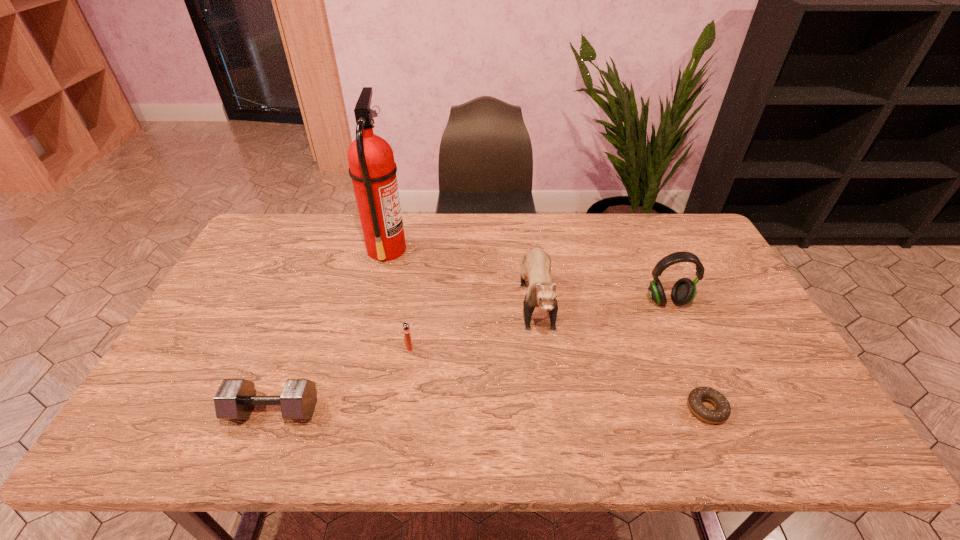
This screenshot has height=540, width=960. What are the coordinates of `vacant space at the far left corner of the desktop` in the screenshot? It's located at (282, 251).

Image resolution: width=960 pixels, height=540 pixels. I want to click on unoccupied area between the igniter and the leftmost object, so click(x=342, y=379).

I want to click on free space between the headset and the shortest object, so click(686, 355).

This screenshot has width=960, height=540. Identify the location of unoccupied area between the fourth object from left to right and the shortest object. (621, 352).

I want to click on free spot between the leftmost object and the fourth object from right to left, so click(342, 379).

At what (x,y) coordinates should I click in order to perform the action: click on free spot between the fourth object from right to left and the third object from right to left. Please return your answer as a coordinate pair (x, y). Looking at the image, I should click on (472, 321).

You are a GUI agent. You are given a task and a screenshot of the screen. Output one action in this format:
    pyautogui.click(x=<x>, y=<y>)
    Task: Click on the vacant area that lies between the shortest object and the leftmost object
    The width and height of the screenshot is (960, 540).
    Given the screenshot: What is the action you would take?
    pyautogui.click(x=490, y=409)

The width and height of the screenshot is (960, 540). I want to click on blank region between the fifth object from right to left and the fourth object from right to left, so click(x=398, y=298).

The image size is (960, 540). Identify the location of blank region between the dumbbell and the tallest object. (330, 329).

I want to click on free space between the leftmost object and the ferret, so click(405, 353).